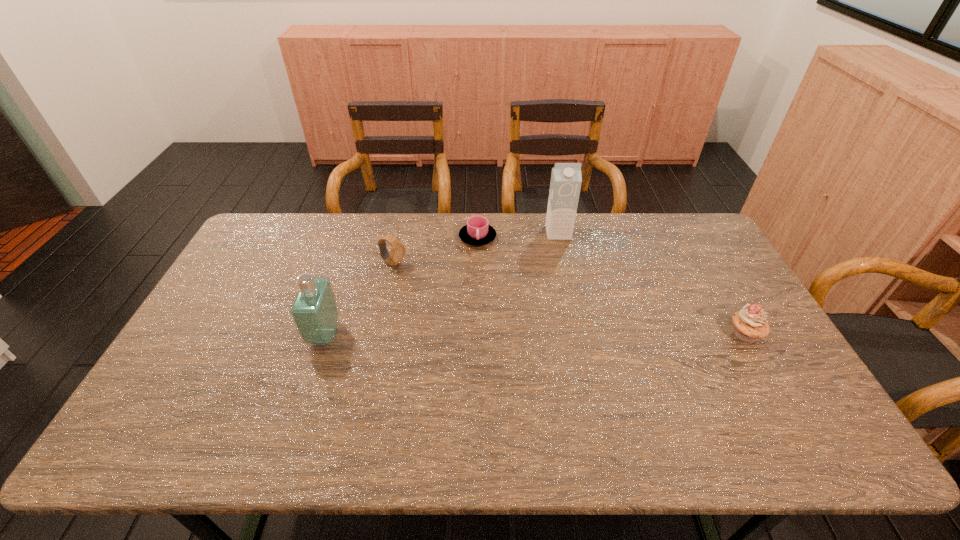
The image size is (960, 540). I want to click on perfume, so click(x=314, y=311).

Image resolution: width=960 pixels, height=540 pixels. I want to click on the leftmost object, so click(x=314, y=311).

Where is `the rightmost object`? the rightmost object is located at coordinates coord(750,324).

The width and height of the screenshot is (960, 540). Identify the location of the third farthest object. [397, 252].

Where is `the second object from left to right`? the second object from left to right is located at coordinates (397, 252).

You are a GUI agent. You are given a task and a screenshot of the screen. Output one action in this format:
    pyautogui.click(x=<x>, y=<y>)
    Task: Click on the carton
    
    Given the screenshot: What is the action you would take?
    pyautogui.click(x=566, y=179)

This screenshot has height=540, width=960. I want to click on the tallest object, so click(x=566, y=179).

Find the location of a particular element. the third object from left to right is located at coordinates (477, 232).

This screenshot has height=540, width=960. Find the location of `cup`. cup is located at coordinates (477, 232).

Find the location of `free space located on the front label of the leftmost object`. free space located on the front label of the leftmost object is located at coordinates (286, 335).